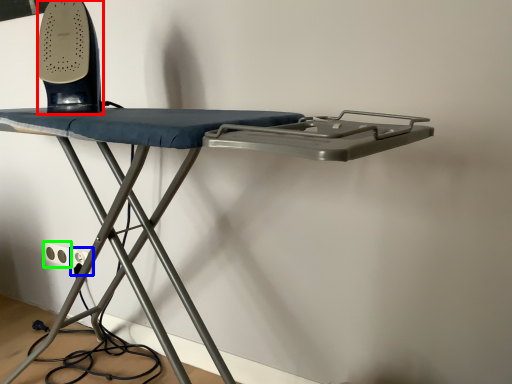
Question: Which object is positioned closest to equipment (highlighted by a red box)? Select from electric outlet (highlighted by a blue box) and electric outlet (highlighted by a green box).

Choices:
 (A) electric outlet
 (B) electric outlet

Answer: (A)